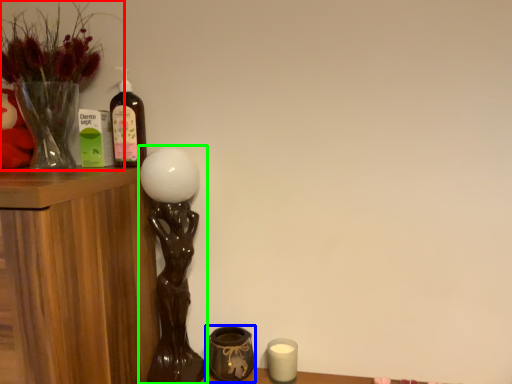
Question: Estimate the real-world distances between objects in this image. Which object is closer to houseplant (highlighted by a red box), candle holder (highlighted by a blue box) or table lamp (highlighted by a green box)?

Choices:
 (A) candle holder
 (B) table lamp

Answer: (B)